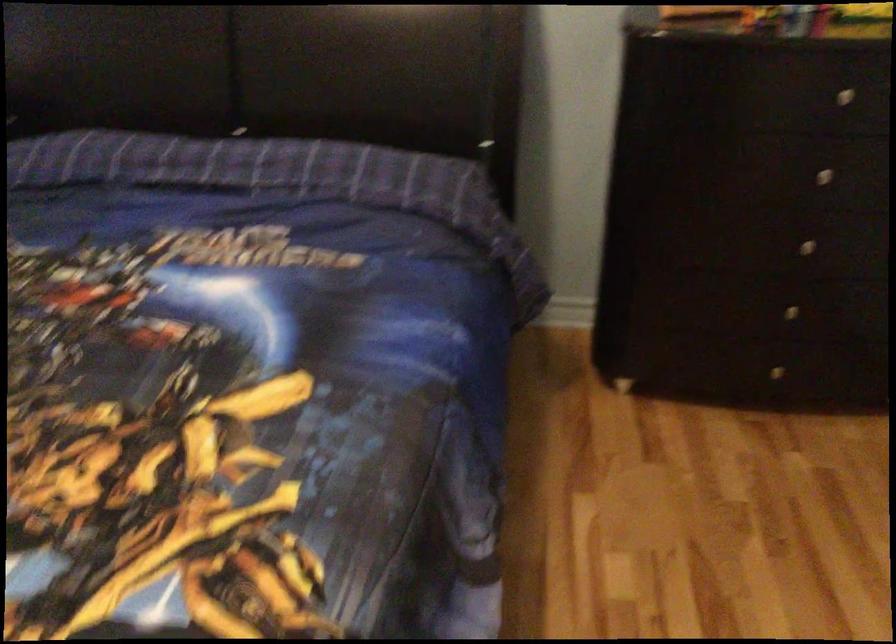
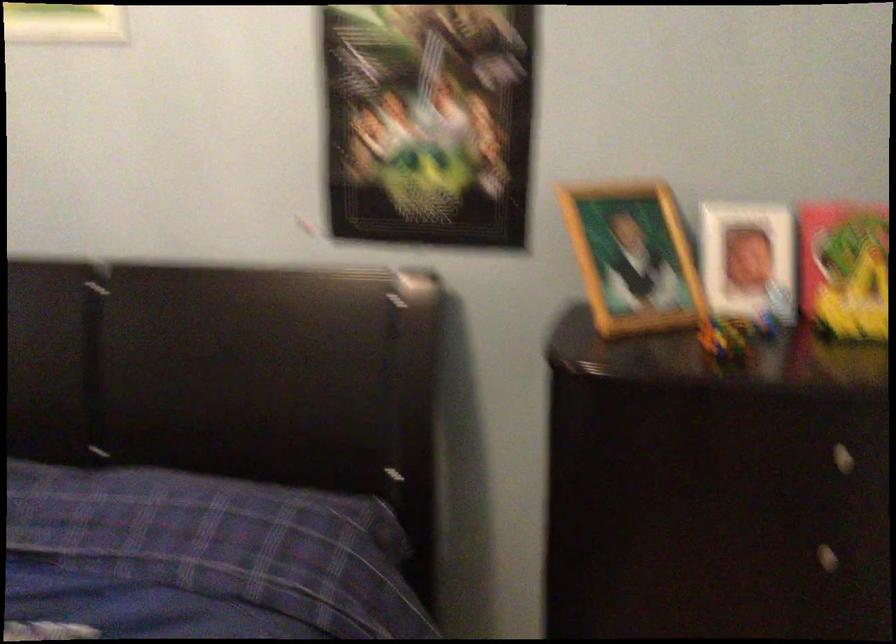
The point at (810, 180) is marked in the first image. Where is the corresponding point in the second image?

(807, 554)